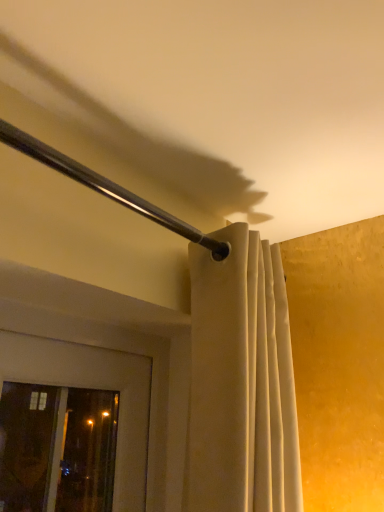
This screenshot has height=512, width=384. What do you see at coordinates (107, 188) in the screenshot?
I see `polished metal rod at upper center` at bounding box center [107, 188].

Find the location of a particular element. This screenshot has width=384, height=512. polished metal rod at upper center is located at coordinates (107, 188).

At what (x,y) coordinates should I click in order to perform the action: click on polished metal rod at upper center. Please return your answer as a coordinate pair (x, y). This screenshot has height=512, width=384. Looking at the image, I should click on (107, 188).